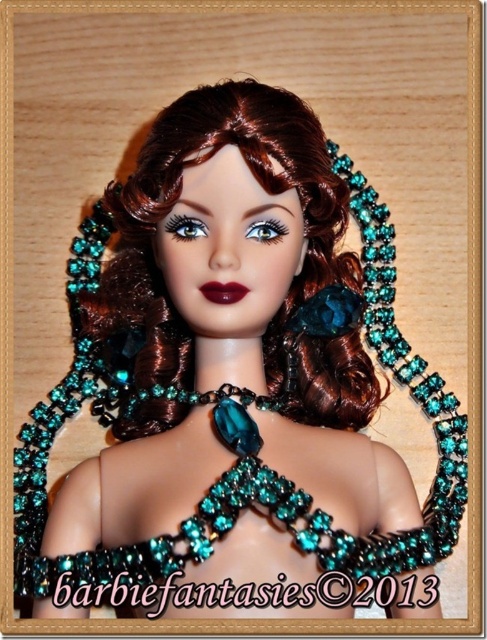
Between shiny brown hair at center and teal beaded necklace at center, which one is positioned lower?

teal beaded necklace at center is lower down.

Is point (266, 177) closer to viewer compared to point (265, 493)?

No, it is behind (265, 493).

Describe the element at coordinates (179, 196) in the screenshot. I see `shiny brown hair at center` at that location.

The height and width of the screenshot is (640, 487). What are the coordinates of `shiny brown hair at center` in the screenshot? It's located at (179, 196).